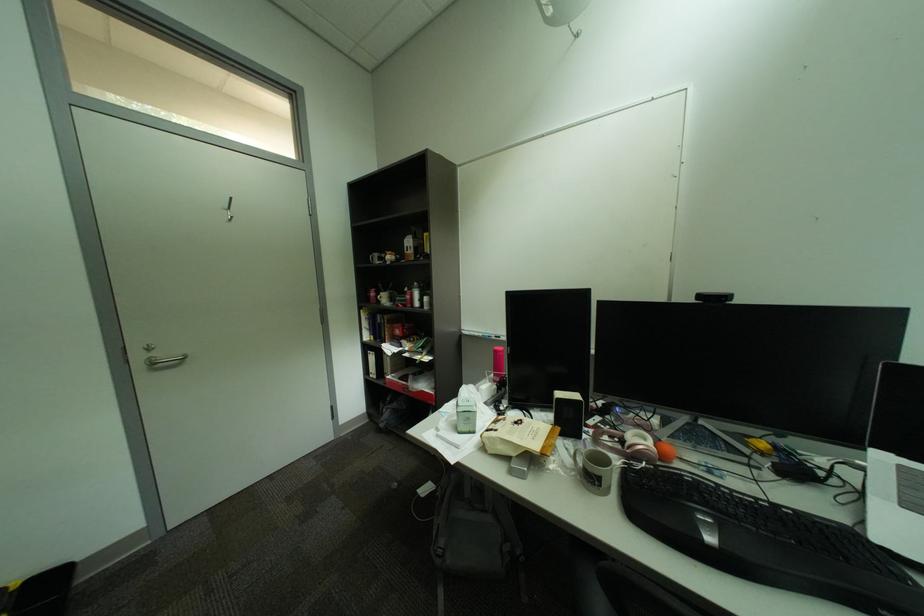
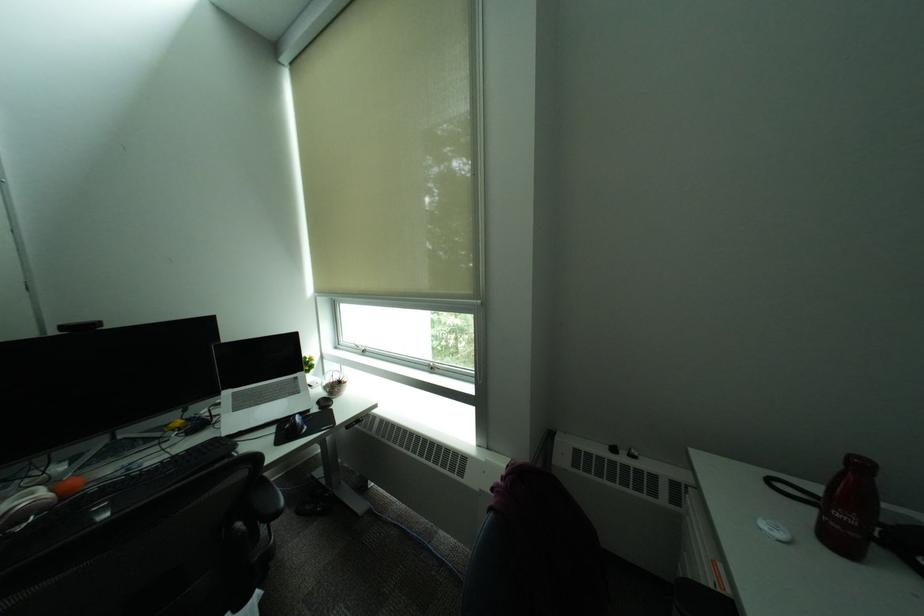
Question: The camera is either moving clockwise (left) or counter-clockwise (right) around the object. The first image is from the beginning of the video and the second image is from the end. Is the camera moving left or right when shooting the video?

Choices:
 (A) Left
 (B) Right

Answer: (A)